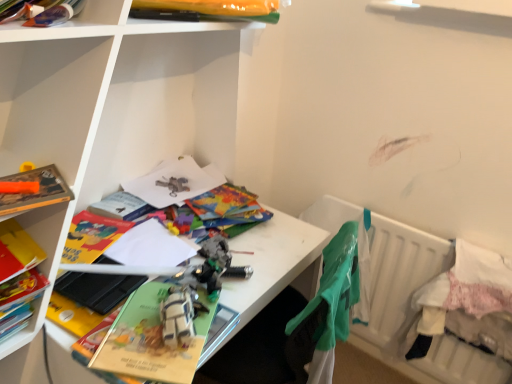
At what (x,y) coordinates should I click in order to perform the action: click on vacant area situated to the left side of white plastic toy at center. Please return your answer as a coordinate pair (x, y). The width and height of the screenshot is (512, 384). Looking at the image, I should click on (129, 327).